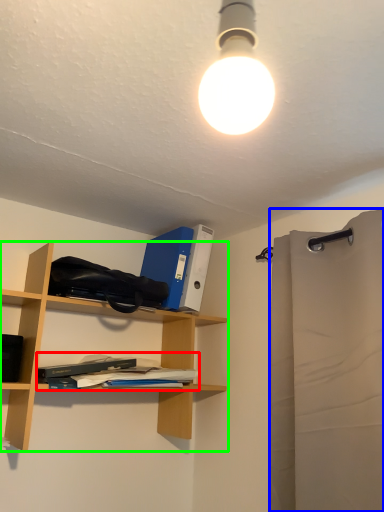
Question: Estimate the real-world distances between objects in this image. Which object is farther from book (highlighted by a red box), shower curtain (highlighted by a blue box) or shelf (highlighted by a green box)?

Choices:
 (A) shower curtain
 (B) shelf

Answer: (A)